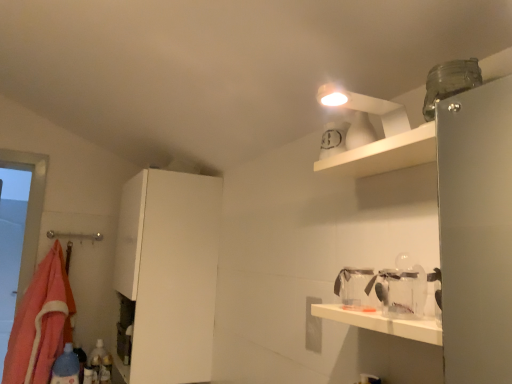
Question: In terms of width, does white matte cabinet at left look wider or thinner when compared to orange fleece blanket at left?

Choices:
 (A) wide
 (B) thin

Answer: (A)

Question: From the image's perspective, is white matte cabinet at left located above or below orange fleece blanket at left?

Choices:
 (A) below
 (B) above

Answer: (B)

Question: Considering the real-world distances, which object is farthest from the blue plastic bottle at lower left?

Choices:
 (A) transparent plastic jar at lower right
 (B) orange fleece blanket at left
 (C) white matte cabinet at left

Answer: (A)

Question: Estimate the real-world distances between objects in this image. Which object is closer to the orange fleece blanket at left?

Choices:
 (A) transparent plastic jar at lower right
 (B) blue plastic bottle at lower left
 (C) white matte cabinet at left

Answer: (B)